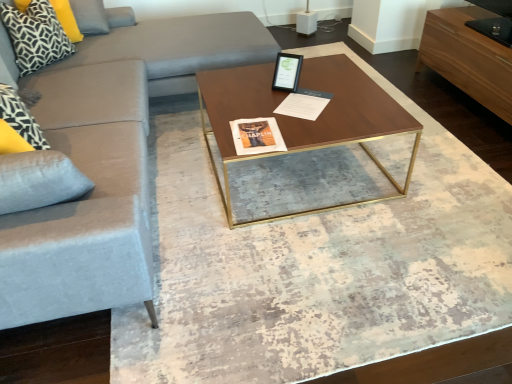
I want to click on patterned fabric pillow at upper left, which is the first pillow in front-to-back order, so click(35, 36).

The height and width of the screenshot is (384, 512). What do you see at coordinates (468, 57) in the screenshot?
I see `light brown wood drawer at upper right` at bounding box center [468, 57].

Image resolution: width=512 pixels, height=384 pixels. I want to click on velvet light gray couch at left, so click(x=109, y=162).

Locate an element on the screen. black and white geometric pillow at upper left, which appears as the 1th pillow when viewed from the back is located at coordinates (67, 19).

Is black and white geometric pillow at upper left, which appears as the 1th pillow when viewed from the back, located outside walnut wood coffee table at center?

black and white geometric pillow at upper left, which appears as the 1th pillow when viewed from the back, lies outside walnut wood coffee table at center's area.

Can you confirm if black and white geometric pillow at upper left, which appears as the 1th pillow when viewed from the back, is bigger than walnut wood coffee table at center?

No.

Measure the distance between black and white geometric pillow at upper left, the 2th pillow viewed from the front, and walnut wood coffee table at center.

They are 1.60 meters apart.

Is black and white geometric pillow at upper left, which appears as the 1th pillow when viewed from the back, at the left side of walnut wood coffee table at center?

Correct, you'll find black and white geometric pillow at upper left, which appears as the 1th pillow when viewed from the back, to the left of walnut wood coffee table at center.

How far apart are white paper at center and walnut wood coffee table at center?

The distance of white paper at center from walnut wood coffee table at center is 10.79 inches.

Considering the relative positions of white paper at center and walnut wood coffee table at center in the image provided, is white paper at center to the left of walnut wood coffee table at center from the viewer's perspective?

No.

Considering the sizes of objects white paper at center and walnut wood coffee table at center in the image provided, who is bigger, white paper at center or walnut wood coffee table at center?

walnut wood coffee table at center is bigger.

In order to click on magazine to the right of walnut wood coffee table at center in this screenshot , I will do `click(304, 104)`.

Is walnut wood coffee table at center inside the boundaries of light brown wood drawer at upper right, or outside?

The correct answer is: outside.

How different are the orientations of walnut wood coffee table at center and light brown wood drawer at upper right in degrees?

The facing directions of walnut wood coffee table at center and light brown wood drawer at upper right are 179 degrees apart.

Between walnut wood coffee table at center and light brown wood drawer at upper right, which one has smaller size?

With smaller size is light brown wood drawer at upper right.

Does walnut wood coffee table at center appear on the right side of light brown wood drawer at upper right?

In fact, walnut wood coffee table at center is to the left of light brown wood drawer at upper right.

Does velvet light gray couch at left turn towards walnut wood coffee table at center?

Yes, velvet light gray couch at left is aimed at walnut wood coffee table at center.

Between velvet light gray couch at left and walnut wood coffee table at center, which one has smaller size?

walnut wood coffee table at center.

Can you confirm if velvet light gray couch at left is positioned to the right of walnut wood coffee table at center?

No.

Find the location of a particular element. This screenshot has height=384, width=512. studio couch located below the walnut wood coffee table at center (from the image's perspective) is located at coordinates (109, 162).

What's the angular difference between patterned fabric pillow at upper left, the second pillow from the back, and walnut wood coffee table at center's facing directions?

The facing directions of patterned fabric pillow at upper left, the second pillow from the back, and walnut wood coffee table at center are 45.5 degrees apart.

From the picture: From the image's perspective, between patterned fabric pillow at upper left, the second pillow from the back, and walnut wood coffee table at center, which one is located above?

patterned fabric pillow at upper left, the second pillow from the back, is shown above in the image.

Which object is further away from the camera, patterned fabric pillow at upper left, the second pillow from the back, or walnut wood coffee table at center?

patterned fabric pillow at upper left, the second pillow from the back, is behind.

Considering the sizes of objects patterned fabric pillow at upper left, the second pillow from the back, and walnut wood coffee table at center in the image provided, who is thinner, patterned fabric pillow at upper left, the second pillow from the back, or walnut wood coffee table at center?

patterned fabric pillow at upper left, the second pillow from the back, is thinner.

Which of these two, patterned fabric pillow at upper left, which is the first pillow in front-to-back order, or velvet light gray couch at left, is thinner?

patterned fabric pillow at upper left, which is the first pillow in front-to-back order.

From a real-world perspective, does patterned fabric pillow at upper left, the second pillow from the back, stand above velvet light gray couch at left?

Correct, in the physical world, patterned fabric pillow at upper left, the second pillow from the back, is higher than velvet light gray couch at left.

Is patterned fabric pillow at upper left, the second pillow from the back, taller than velvet light gray couch at left?

In fact, patterned fabric pillow at upper left, the second pillow from the back, may be shorter than velvet light gray couch at left.

From the picture: Is patterned fabric pillow at upper left, which is the first pillow in front-to-back order, outside of velvet light gray couch at left?

Yes, patterned fabric pillow at upper left, which is the first pillow in front-to-back order, is outside of velvet light gray couch at left.

Is walnut wood coffee table at center next to velvet light gray couch at left?

walnut wood coffee table at center and velvet light gray couch at left are not in contact.

What's the angular difference between walnut wood coffee table at center and velvet light gray couch at left's facing directions?

The angular difference between walnut wood coffee table at center and velvet light gray couch at left is 0.945 degrees.

Does walnut wood coffee table at center have a smaller size compared to velvet light gray couch at left?

Yes, walnut wood coffee table at center is smaller than velvet light gray couch at left.

Is the depth of walnut wood coffee table at center less than that of velvet light gray couch at left?

No, the depth of walnut wood coffee table at center is greater than that of velvet light gray couch at left.

You are a GUI agent. You are given a task and a screenshot of the screen. Output one action in this format:
    pyautogui.click(x=<x>, y=<y>)
    Task: Click on the pillow that is the 2nd object located behind the walnut wood coffee table at center
    This screenshot has height=384, width=512.
    Given the screenshot: What is the action you would take?
    pyautogui.click(x=67, y=19)

You are a GUI agent. You are given a task and a screenshot of the screen. Output one action in this format:
    pyautogui.click(x=<x>, y=<y>)
    Task: Click on the magazine on the right of the walnut wood coffee table at center
    This screenshot has height=384, width=512.
    Given the screenshot: What is the action you would take?
    pyautogui.click(x=304, y=104)

Which object lies further to the anchor point light brown wood drawer at upper right, velvet light gray couch at left or walnut wood coffee table at center?

velvet light gray couch at left lies further to light brown wood drawer at upper right than the other object.

Considering their positions, is black and white geometric pillow at upper left, which appears as the 1th pillow when viewed from the back, positioned further to velvet light gray couch at left than patterned fabric pillow at upper left, the second pillow from the back?

black and white geometric pillow at upper left, which appears as the 1th pillow when viewed from the back, is positioned further to the anchor velvet light gray couch at left.

From the image, which object appears to be nearer to light brown wood drawer at upper right, white paper at center or black and white geometric pillow at upper left, the 2th pillow viewed from the front?

Based on the image, white paper at center appears to be nearer to light brown wood drawer at upper right.

Which object lies further to the anchor point light brown wood drawer at upper right, white paper at center or velvet light gray couch at left?

Based on the image, velvet light gray couch at left appears to be further to light brown wood drawer at upper right.

From the image, which object appears to be nearer to white paper at center, walnut wood coffee table at center or black and white geometric pillow at upper left, which appears as the 1th pillow when viewed from the back?

walnut wood coffee table at center.

Which object lies nearer to the anchor point velvet light gray couch at left, patterned fabric pillow at upper left, which is the first pillow in front-to-back order, or black and white geometric pillow at upper left, which appears as the 1th pillow when viewed from the back?

Among the two, patterned fabric pillow at upper left, which is the first pillow in front-to-back order, is located nearer to velvet light gray couch at left.

Which object lies nearer to the anchor point velvet light gray couch at left, walnut wood coffee table at center or black and white geometric pillow at upper left, which appears as the 1th pillow when viewed from the back?

Among the two, walnut wood coffee table at center is located nearer to velvet light gray couch at left.

Which object lies nearer to the anchor point walnut wood coffee table at center, white paper at center or patterned fabric pillow at upper left, the second pillow from the back?

white paper at center is positioned closer to the anchor walnut wood coffee table at center.

Identify the location of coffee table between velvet light gray couch at left and light brown wood drawer at upper right. The image size is (512, 384). (298, 131).

You are a GUI agent. You are given a task and a screenshot of the screen. Output one action in this format:
    pyautogui.click(x=<x>, y=<y>)
    Task: Click on the pillow situated between black and white geometric pillow at upper left, which appears as the 1th pillow when viewed from the back, and light brown wood drawer at upper right from left to right
    This screenshot has width=512, height=384.
    Given the screenshot: What is the action you would take?
    pyautogui.click(x=35, y=36)

Where is `pillow between velvet light gray couch at left and black and white geometric pillow at upper left, which appears as the 1th pillow when viewed from the back, along the z-axis`? This screenshot has height=384, width=512. pillow between velvet light gray couch at left and black and white geometric pillow at upper left, which appears as the 1th pillow when viewed from the back, along the z-axis is located at coordinates [x=35, y=36].

This screenshot has width=512, height=384. I want to click on magazine situated between patterned fabric pillow at upper left, the second pillow from the back, and light brown wood drawer at upper right from left to right, so click(x=304, y=104).